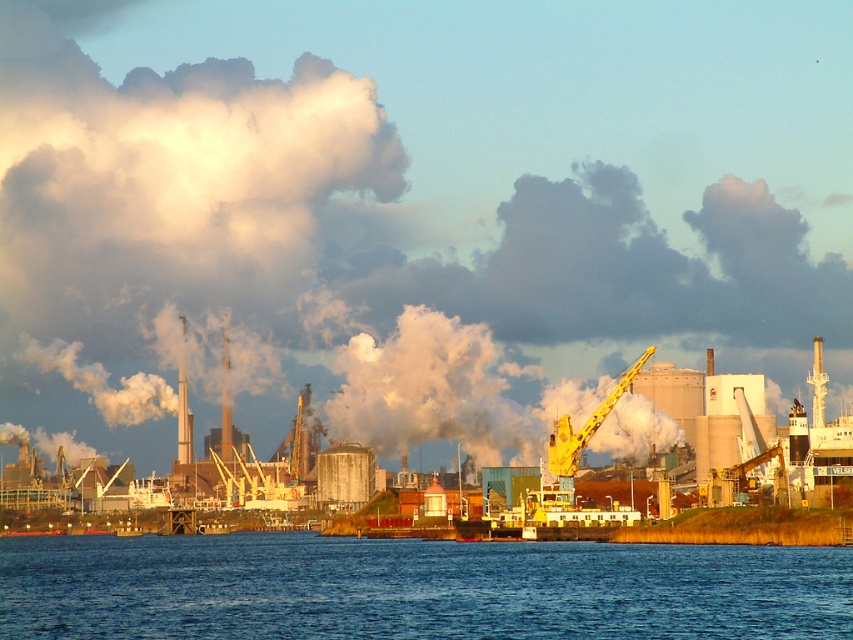
Consider the image. You are a drone operator tasked with capturing aerial footage of the industrial area. Your drone has a maximum flight range of 75 meters. You need to fly from the white smoke at upper center to the yellow metallic crane at center. Will your drone be able to make this trip without needing a recharge?

The distance between the white smoke at upper center and the yellow metallic crane at center is 80.06 meters, which exceeds the drone operator drone maximum flight range of 75 meters. Therefore, the drone will not be able to complete the trip without needing a recharge.

You are a photographer trying to capture the yellow metallic crane at center and the blue liquid water at lower center in a single shot. Based on their positions, which object should you frame first to ensure both are in the shot?

The blue liquid water at lower center is to the left of the yellow metallic crane at center, so you should frame the yellow metallic crane at center first to ensure both are included in the shot.

You are a safety inspector assessing the industrial area. You need to ensure that the blue liquid water at lower center does not overflow into the yellow metallic crane at center. Based on the scene, is there a risk of overflow?

The blue liquid water at lower center is not as tall as the yellow metallic crane at center, so there is no risk of overflow since the water level is lower than the crane.